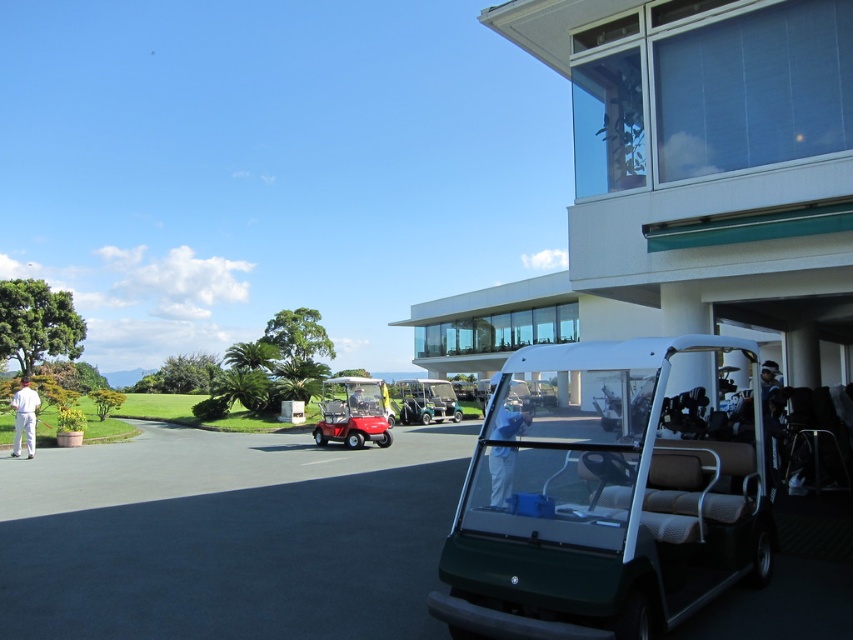
You are a photographer setting up a shoot at the golf resort. You need to position a backdrop that must be taller than both the blue fabric person at center and the white cotton pants at lower left. What is the minimum height the backdrop should be?

The blue fabric person at center is taller than the white cotton pants at lower left. Therefore, the backdrop must be at least as tall as the blue fabric person at center to satisfy the requirement.

You are a delivery person needing to pass through the path between the green plastic golf cart at center and the white cotton pants at lower left. The delivery cart you are using is 1.2 meters wide. Can you fit through the space?

The green plastic golf cart at center is narrower than the white cotton pants at lower left, but the exact width isn

You are a guest at the resort and want to find the green plastic golf cart at center. From your current position near the white cotton pants at lower left, in which direction should you move to reach it?

The green plastic golf cart at center is located below the white cotton pants at lower left, so you should move downward from the white cotton pants at lower left to reach it.